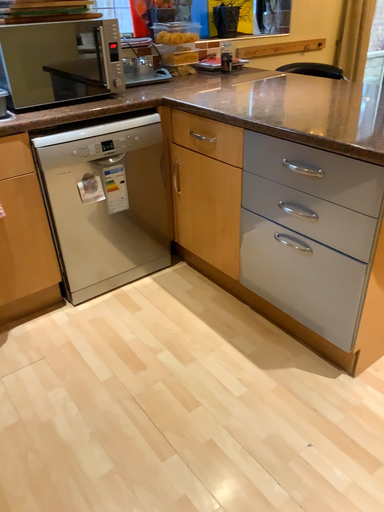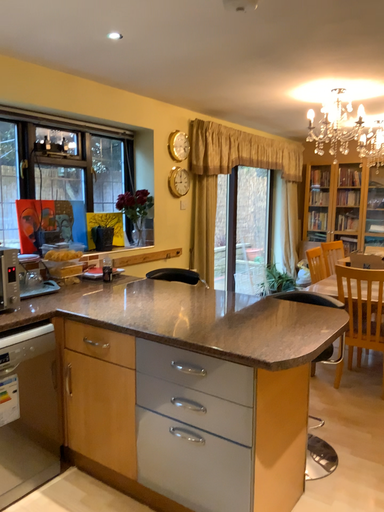
Question: How did the camera likely rotate when shooting the video?

Choices:
 (A) rotated downward
 (B) rotated upward

Answer: (B)